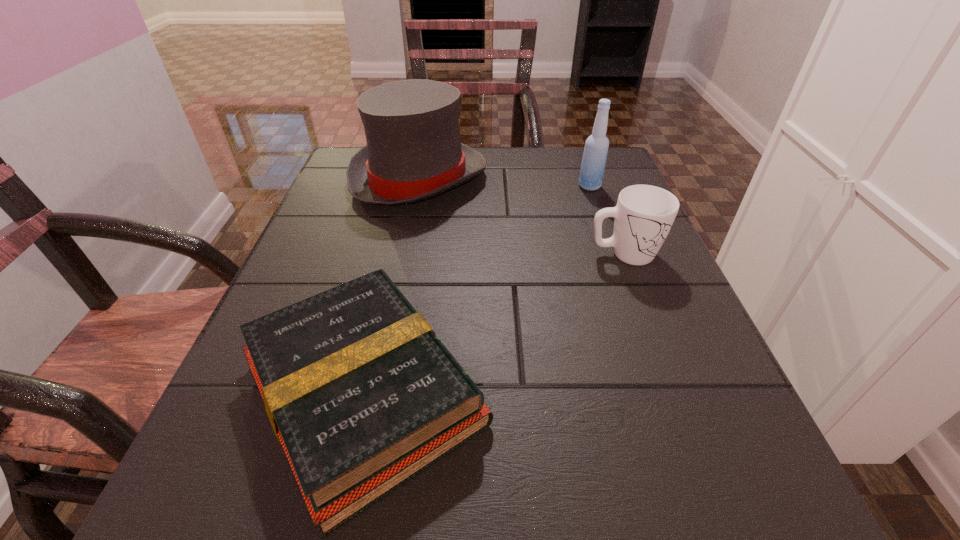
This screenshot has width=960, height=540. In order to click on vacant space at the left edge of the desktop in this screenshot , I will do `click(324, 226)`.

You are a GUI agent. You are given a task and a screenshot of the screen. Output one action in this format:
    pyautogui.click(x=<x>, y=<y>)
    Task: Click on the free space at the right edge of the desktop
    
    Given the screenshot: What is the action you would take?
    pyautogui.click(x=619, y=356)

This screenshot has width=960, height=540. Identify the location of vacant position at the far right corner of the desktop. (551, 146).

You are a GUI agent. You are given a task and a screenshot of the screen. Output one action in this format:
    pyautogui.click(x=<x>, y=<y>)
    Task: Click on the empty location between the nearest object and the bottle
    The image size is (960, 540).
    Given the screenshot: What is the action you would take?
    pyautogui.click(x=477, y=289)

Locate an element on the screen. free space between the second shortest object and the hardback book is located at coordinates (493, 322).

Where is `vacant area that lies between the dress hat and the second nearest object`? The image size is (960, 540). vacant area that lies between the dress hat and the second nearest object is located at coordinates (521, 216).

In order to click on empty space that is in between the hardback book and the bottle in this screenshot , I will do `click(477, 289)`.

Find the location of a particular element. vacant space that's between the nearest object and the third farthest object is located at coordinates tap(493, 322).

This screenshot has width=960, height=540. Find the location of `free space between the bottle and the hardback book`. free space between the bottle and the hardback book is located at coordinates (477, 289).

Where is `vacant space in between the bottle and the nearest object`? The image size is (960, 540). vacant space in between the bottle and the nearest object is located at coordinates (477, 289).